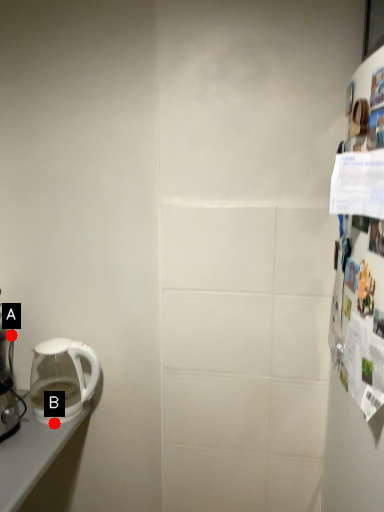
Question: Two points are circled on the image, labeled by A and B beside each circle. Which point is farther to the camera?

Choices:
 (A) A is further
 (B) B is further

Answer: (A)